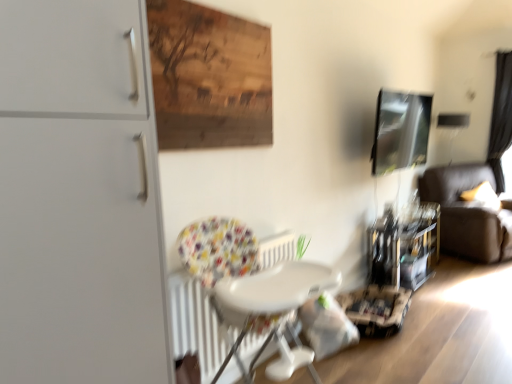
Question: Is black fabric curtain at right positioned behind matte white cabinet at left?

Choices:
 (A) no
 (B) yes

Answer: (B)

Question: Is black fabric curtain at right in contact with matte white cabinet at left?

Choices:
 (A) yes
 (B) no

Answer: (B)

Question: From the image's perspective, is black fabric curtain at right over matte white cabinet at left?

Choices:
 (A) no
 (B) yes

Answer: (B)

Question: Can you confirm if black fabric curtain at right is wider than matte white cabinet at left?

Choices:
 (A) no
 (B) yes

Answer: (A)

Question: Is black fabric curtain at right smaller than matte white cabinet at left?

Choices:
 (A) yes
 (B) no

Answer: (A)

Question: In the image, is metallic glossy picture frame at upper right on the left side or the right side of white plastic chair at center?

Choices:
 (A) left
 (B) right

Answer: (B)

Question: In the image, is metallic glossy picture frame at upper right positioned in front of or behind white plastic chair at center?

Choices:
 (A) front
 (B) behind

Answer: (B)

Question: Looking at the image, does metallic glossy picture frame at upper right seem bigger or smaller compared to white plastic chair at center?

Choices:
 (A) big
 (B) small

Answer: (B)

Question: Which is correct: metallic glossy picture frame at upper right is inside white plastic chair at center, or outside of it?

Choices:
 (A) outside
 (B) inside

Answer: (A)

Question: Is point (507, 82) closer or farther from the camera than point (161, 314)?

Choices:
 (A) closer
 (B) farther

Answer: (B)

Question: In the image, is black fabric curtain at right positioned in front of or behind matte white cabinet at left?

Choices:
 (A) front
 (B) behind

Answer: (B)

Question: Based on their sizes in the image, would you say black fabric curtain at right is bigger or smaller than matte white cabinet at left?

Choices:
 (A) big
 (B) small

Answer: (B)

Question: Looking at their shapes, would you say black fabric curtain at right is wider or thinner than matte white cabinet at left?

Choices:
 (A) wide
 (B) thin

Answer: (B)

Question: Is dark brown leather couch at right wider or thinner than metallic glossy picture frame at upper right?

Choices:
 (A) thin
 (B) wide

Answer: (B)

Question: Is dark brown leather couch at right in front of or behind metallic glossy picture frame at upper right in the image?

Choices:
 (A) behind
 (B) front

Answer: (A)